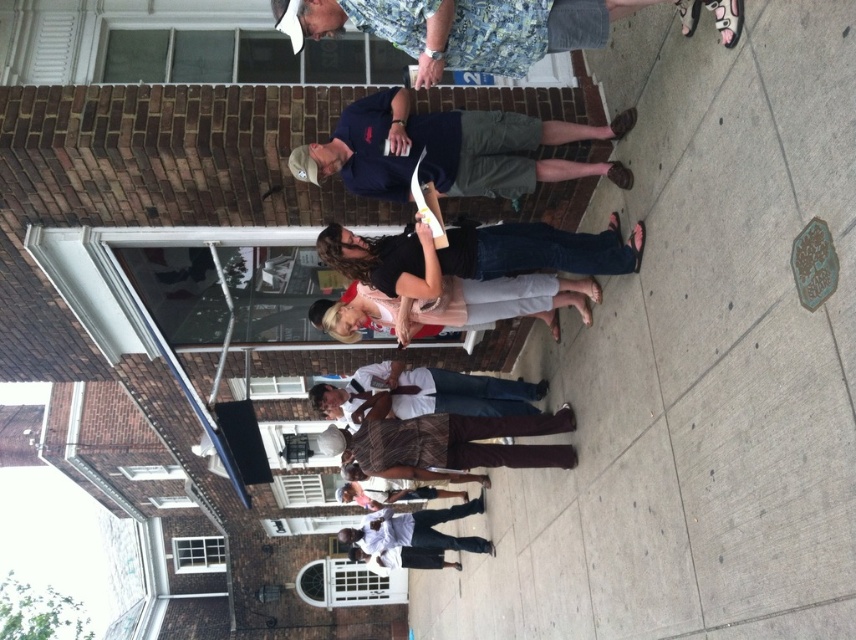
You are a photographer trying to capture a candid shot of the light pink sheer blouse at center and the brown plaid pants at center. Since you want to focus on both subjects equally, which side should you position yourself to ensure both are visible without any obstruction?

You should position yourself to the right side of the light pink sheer blouse at center because the brown plaid pants at center is on the left side of it, allowing both subjects to be visible without obstruction.

You are standing at the entrance of the brick building and see the point marked at coordinates (x=449, y=442). What clothing item is located at that point?

The point marked at coordinates (x=449, y=442) indicates the location of the brown plaid pants at center.